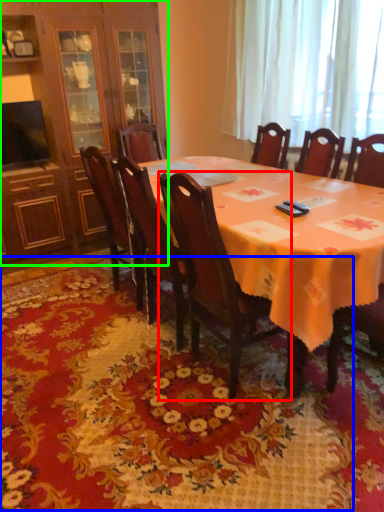
Question: Which object is the farthest from chair (highlighted by a red box)? Choose among these: mat (highlighted by a blue box) or cabinetry (highlighted by a green box).

Choices:
 (A) mat
 (B) cabinetry

Answer: (B)